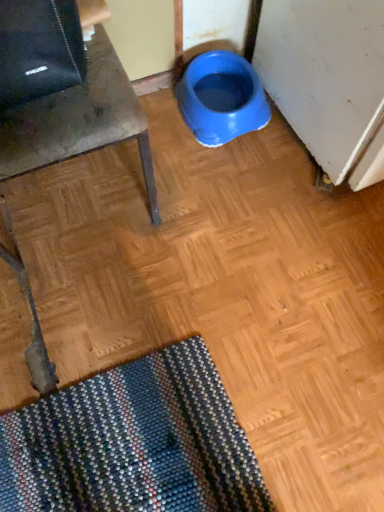
Question: Considering the relative sizes of matte gray chair at left and blue plastic bowl at center in the image provided, is matte gray chair at left smaller than blue plastic bowl at center?

Choices:
 (A) yes
 (B) no

Answer: (B)

Question: Is the position of matte gray chair at left less distant than that of blue plastic bowl at center?

Choices:
 (A) yes
 (B) no

Answer: (A)

Question: Considering the relative positions of matte gray chair at left and blue plastic bowl at center in the image provided, is matte gray chair at left to the left of blue plastic bowl at center from the viewer's perspective?

Choices:
 (A) no
 (B) yes

Answer: (B)

Question: Is matte gray chair at left facing towards blue plastic bowl at center?

Choices:
 (A) no
 (B) yes

Answer: (A)

Question: Are matte gray chair at left and blue plastic bowl at center far apart?

Choices:
 (A) no
 (B) yes

Answer: (A)

Question: Does matte gray chair at left lie behind blue plastic bowl at center?

Choices:
 (A) yes
 (B) no

Answer: (B)

Question: From a real-world perspective, is blue plastic bowl at center positioned under matte gray chair at left based on gravity?

Choices:
 (A) no
 (B) yes

Answer: (B)

Question: Is blue plastic bowl at center next to matte gray chair at left?

Choices:
 (A) no
 (B) yes

Answer: (A)

Question: Does blue plastic bowl at center have a lesser width compared to matte gray chair at left?

Choices:
 (A) yes
 (B) no

Answer: (A)

Question: Does blue plastic bowl at center lie in front of matte gray chair at left?

Choices:
 (A) yes
 (B) no

Answer: (B)

Question: Is blue plastic bowl at center positioned far away from matte gray chair at left?

Choices:
 (A) yes
 (B) no

Answer: (B)

Question: Could you tell me if blue plastic bowl at center is facing matte gray chair at left?

Choices:
 (A) no
 (B) yes

Answer: (A)

Question: Visually, is matte gray chair at left positioned to the left or to the right of blue plastic bowl at center?

Choices:
 (A) right
 (B) left

Answer: (B)